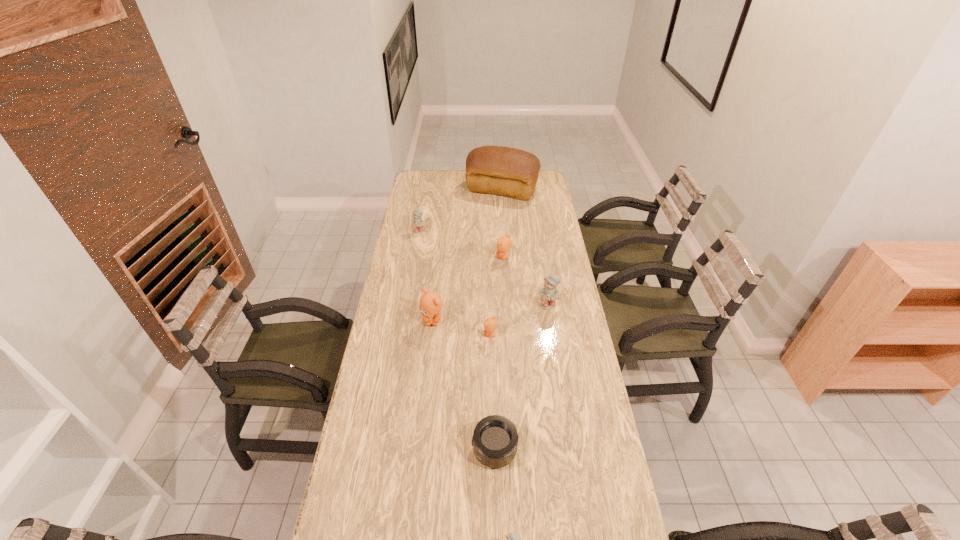
The image size is (960, 540). Find the location of `brown bread`. brown bread is located at coordinates (511, 172).

This screenshot has height=540, width=960. Identify the location of the tallest object. (511, 172).

Where is `the fourth nearest teddy bear`? This screenshot has width=960, height=540. the fourth nearest teddy bear is located at coordinates (548, 294).

Image resolution: width=960 pixels, height=540 pixels. I want to click on the second nearest blue teddy bear, so click(548, 294).

You are a GUI agent. You are given a task and a screenshot of the screen. Output one action in this format:
    pyautogui.click(x=<x>, y=<y>)
    Task: Click on the third nearest teddy bear
    The image size is (960, 540).
    Given the screenshot: What is the action you would take?
    pyautogui.click(x=430, y=305)

Where is `the fifth farthest object`? the fifth farthest object is located at coordinates pyautogui.click(x=430, y=305).

Locate an element on the screen. Image resolution: width=960 pixels, height=540 pixels. the second biggest brown teddy bear is located at coordinates (504, 243).

I want to click on the farthest brown teddy bear, so click(x=504, y=243).

Identify the location of the farthest teddy bear. (417, 225).

The width and height of the screenshot is (960, 540). What are the coordinates of `the leftmost blue teddy bear` in the screenshot? It's located at (417, 225).